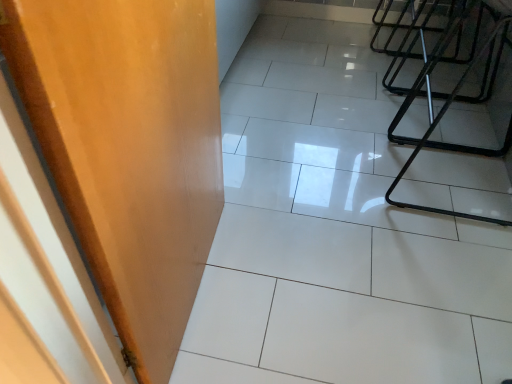
Where is `vacant area that is situated to the right of wooden door at left`? Image resolution: width=512 pixels, height=384 pixels. vacant area that is situated to the right of wooden door at left is located at coordinates (310, 279).